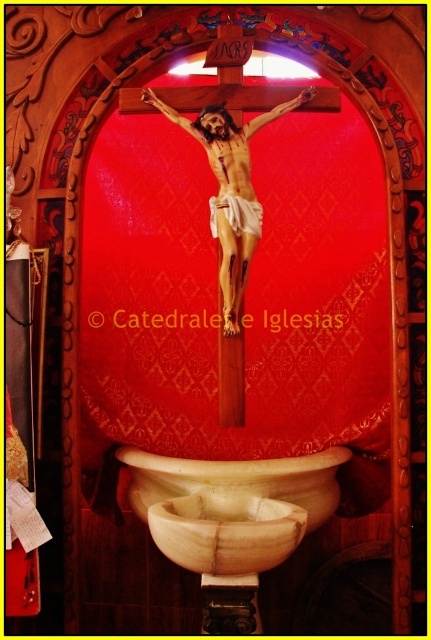
You are a visitor in a church and see the white marble basin at lower center and the white marble sink at lower center. Which one is positioned lower in the image?

The white marble basin at lower center is located below the white marble sink at lower center, so it is positioned lower in the image.

Looking at this image, you are a visitor in the church and want to wash your hands before the service. You see a white marble basin at lower center and a white marble sink at lower center. Which one is on the left side?

The white marble basin at lower center is positioned on the left side of the white marble sink at lower center.